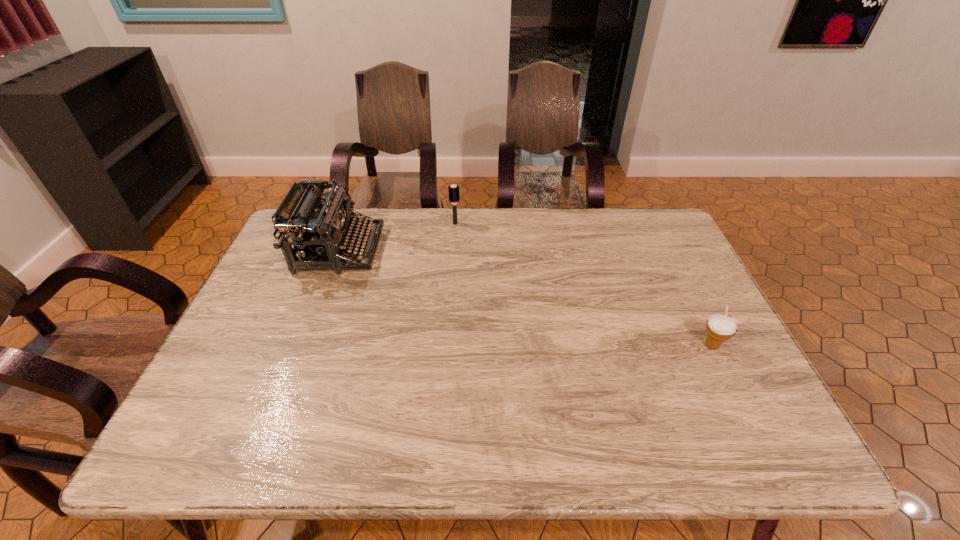
Where is `free point that satisfies the following two spatial constraints: 1. on the back side of the icecream; 2. on the typing side of the leftmost object`? Image resolution: width=960 pixels, height=540 pixels. free point that satisfies the following two spatial constraints: 1. on the back side of the icecream; 2. on the typing side of the leftmost object is located at coordinates (664, 250).